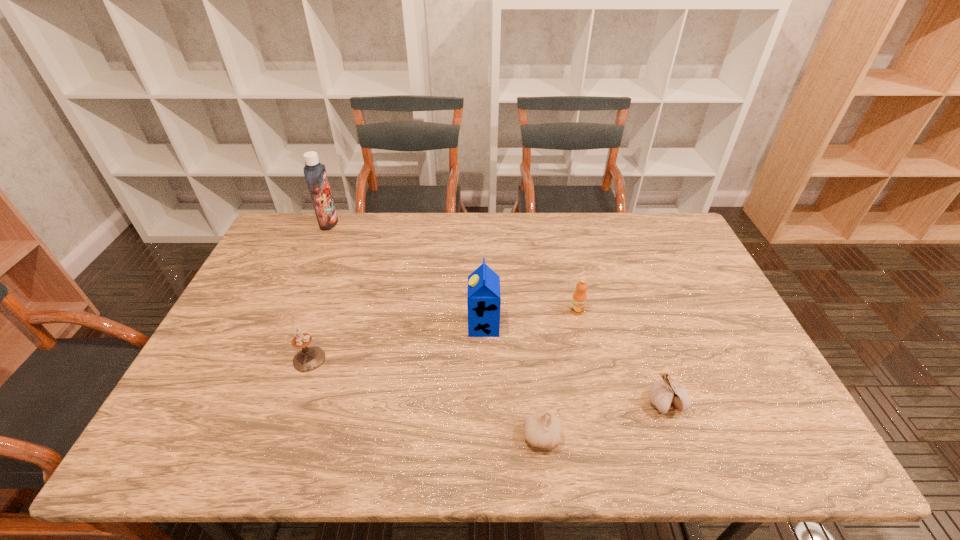
Where is `the leftmost object`? The height and width of the screenshot is (540, 960). the leftmost object is located at coordinates (315, 173).

Identify the location of the tallest object. The height and width of the screenshot is (540, 960). pos(315,173).

This screenshot has height=540, width=960. I want to click on the fifth shortest object, so click(x=483, y=295).

Locate an element on the screen. The width and height of the screenshot is (960, 540). the third object from left to right is located at coordinates (483, 295).

Find the location of `the fifth object from right to left`. the fifth object from right to left is located at coordinates (309, 358).

You are a GUI agent. You are given a task and a screenshot of the screen. Output one action in this format:
    pyautogui.click(x=<x>, y=<y>)
    Task: Click on the candle holder
    This screenshot has width=960, height=540.
    Given the screenshot: What is the action you would take?
    point(309,358)

This screenshot has height=540, width=960. I want to click on the second object from right to left, so click(x=579, y=298).

At what (x,y) coordinates should I click in order to perform the action: click on the right garlic. Please return your answer as a coordinate pair (x, y). This screenshot has height=540, width=960. Looking at the image, I should click on (666, 394).

The image size is (960, 540). I want to click on the second nearest object, so click(666, 394).

The height and width of the screenshot is (540, 960). I want to click on the fourth object from left to right, so click(x=542, y=429).